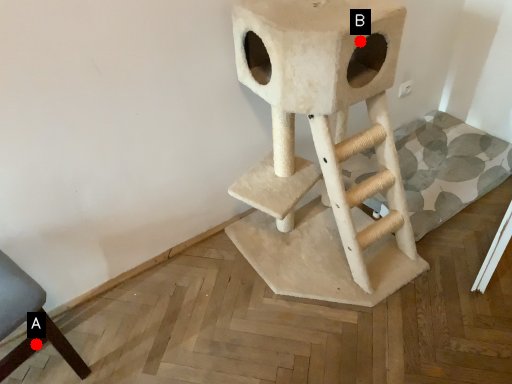
Question: Two points are circled on the image, labeled by A and B beside each circle. Among these points, which one is nearest to the camera?

Choices:
 (A) A is closer
 (B) B is closer

Answer: (B)